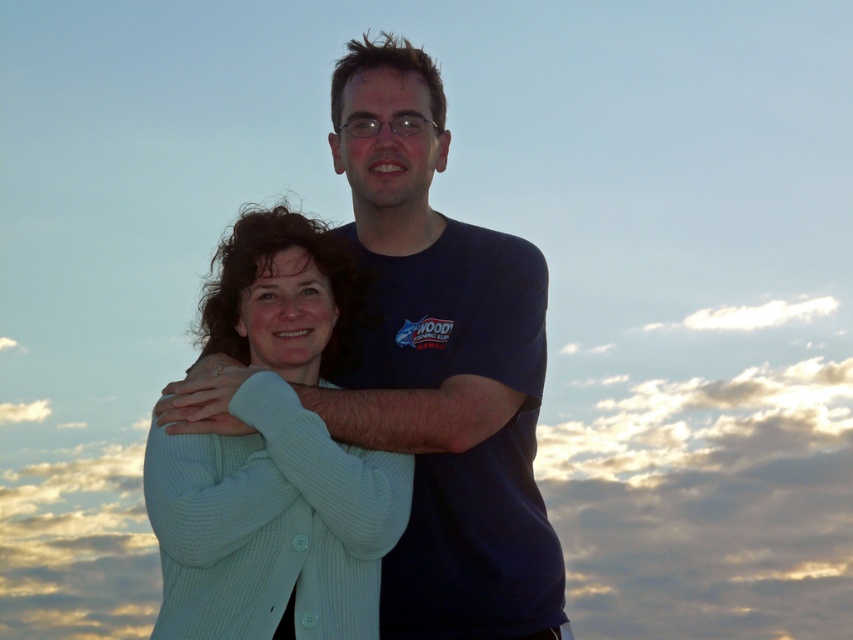
Question: Which object is farther from the camera taking this photo?

Choices:
 (A) white knit sweater at center
 (B) light blue knit sweater at center

Answer: (A)

Question: Which of the following is the farthest from the observer?

Choices:
 (A) white knit sweater at center
 (B) light blue knit sweater at center

Answer: (A)

Question: Which of the following is the farthest from the observer?

Choices:
 (A) (311, 292)
 (B) (364, 237)

Answer: (B)

Question: Is white knit sweater at center further to the viewer compared to light blue knit sweater at center?

Choices:
 (A) yes
 (B) no

Answer: (A)

Question: Is white knit sweater at center wider than light blue knit sweater at center?

Choices:
 (A) yes
 (B) no

Answer: (B)

Question: Can you confirm if white knit sweater at center is positioned above light blue knit sweater at center?

Choices:
 (A) no
 (B) yes

Answer: (B)